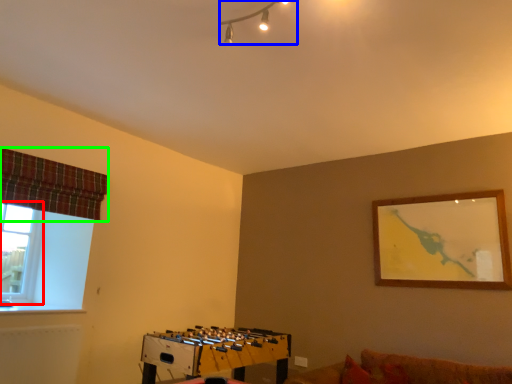
Question: Considering the real-world distances, which object is farthest from window (highlighted by a red box)? lamp (highlighted by a blue box) or curtain (highlighted by a green box)?

Choices:
 (A) lamp
 (B) curtain

Answer: (A)